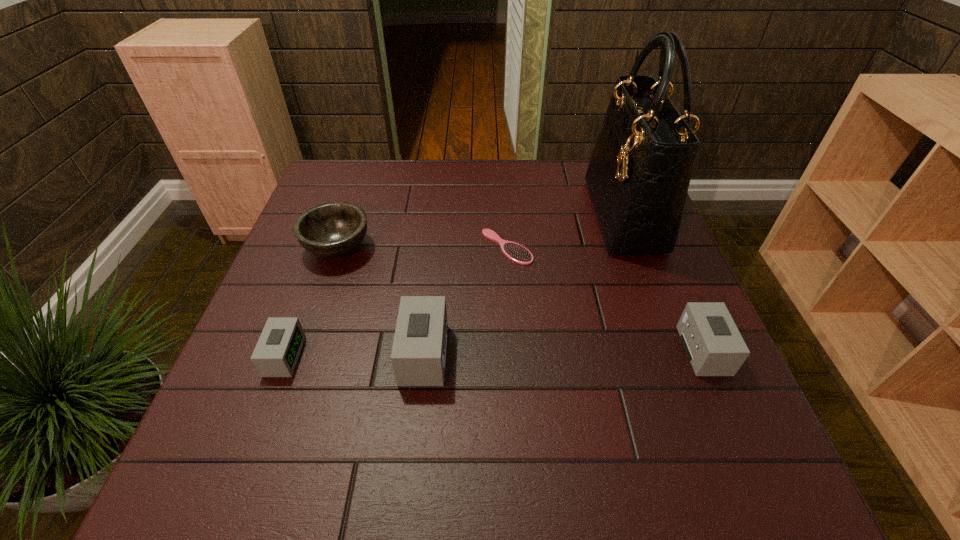
You are a GUI agent. You are given a task and a screenshot of the screen. Output one action in this format:
    pyautogui.click(x=<x>, y=<y>)
    Task: Click on the alarm clock that can be found as the second closest to the hairbrush
    
    Given the screenshot: What is the action you would take?
    pyautogui.click(x=713, y=344)

Locate an element on the screen. alarm clock that stands as the third closest to the hairbrush is located at coordinates (277, 351).